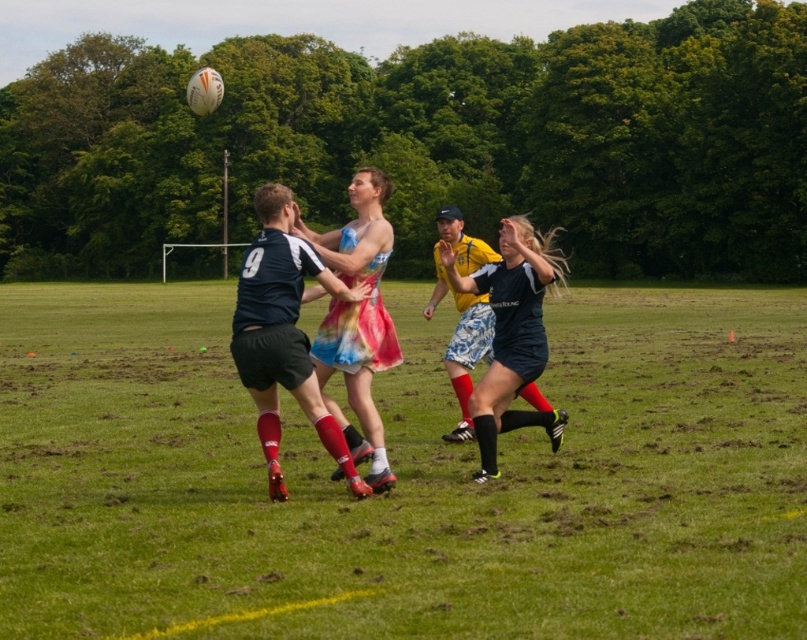
Question: Which is nearer to the rainbow printed dress at center?

Choices:
 (A) green grass at center
 (B) matte black shorts at center

Answer: (B)

Question: Does matte black shorts at center have a larger size compared to rainbow printed dress at center?

Choices:
 (A) yes
 (B) no

Answer: (B)

Question: Which object is farther from the camera taking this photo?

Choices:
 (A) matte black shorts at center
 (B) matte black dress at center
 (C) green grass at center
 (D) rainbow printed dress at center

Answer: (B)

Question: Considering the relative positions of matte black shorts at center and rainbow printed dress at center in the image provided, where is matte black shorts at center located with respect to rainbow printed dress at center?

Choices:
 (A) left
 (B) right

Answer: (A)

Question: Among these points, which one is farthest from the camera?

Choices:
 (A) (460, 285)
 (B) (324, 320)

Answer: (A)

Question: Observing the image, what is the correct spatial positioning of matte black shorts at center in reference to rainbow printed dress at center?

Choices:
 (A) below
 (B) above

Answer: (A)